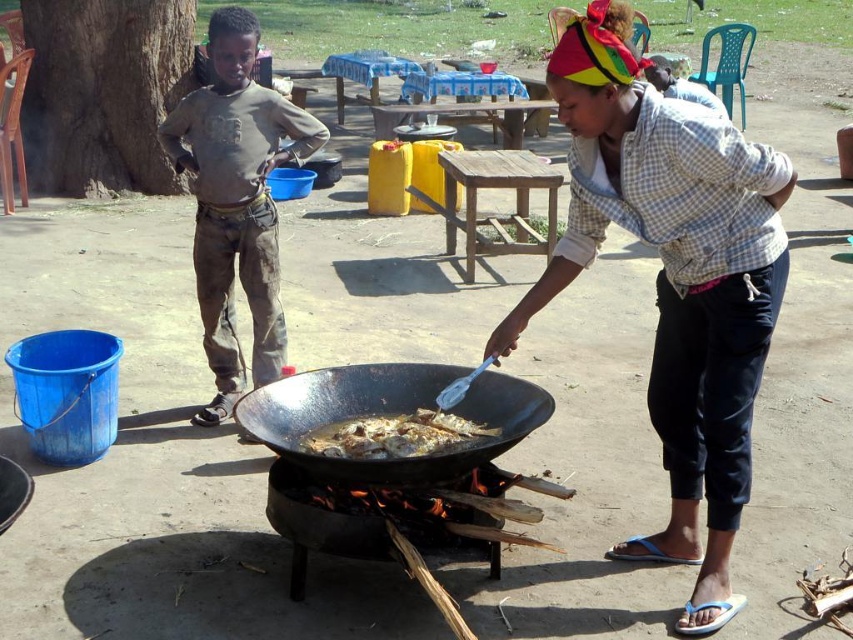
You are standing at the point marked by coordinates point (236, 202). What object is exactly at that location?

The brown cotton pants at left is located at point (236, 202).

You are a chef standing to the right of the black matte wok at center and the golden brown crispy fish at center. Which object is closer to your right side?

The golden brown crispy fish at center is closer to your right side since the black matte wok at center is positioned to its left.

You are a chef preparing food for a large gathering. You have a brown cotton pants at left and a golden brown crispy fish at center in your view. Which item is bigger in size?

The brown cotton pants at left is larger in size compared to the golden brown crispy fish at center.